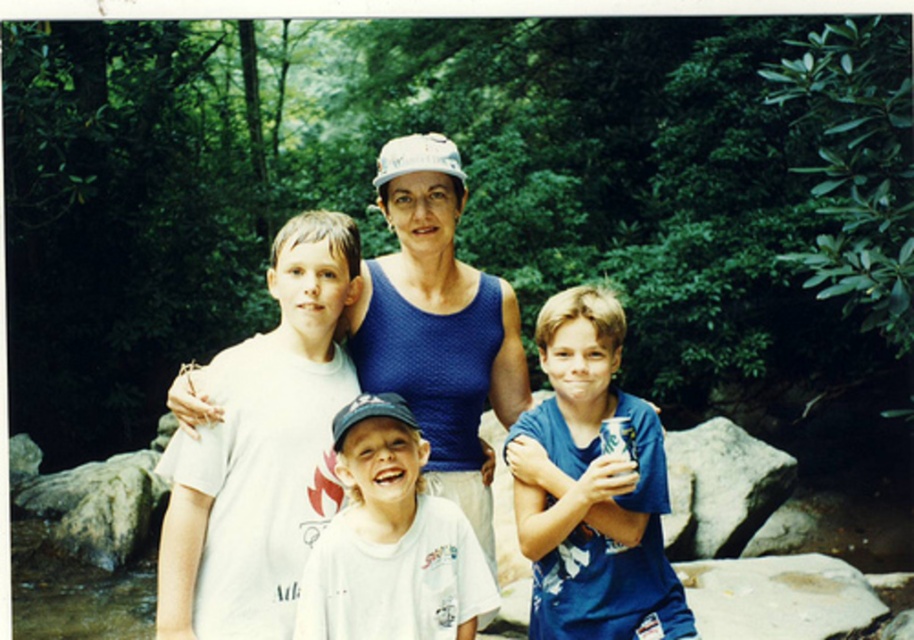
You are a photographer trying to capture a group photo of the blue mesh tank top at center and the blue cotton shirt at center. The camera you are using has a minimum focus distance of 20 inches. Can you focus on both subjects simultaneously without moving the camera?

The blue mesh tank top at center is 20.45 inches from the blue cotton shirt at center, which is just over the camera minimum focus distance of 20 inches. Therefore, you can focus on both subjects simultaneously without moving the camera.